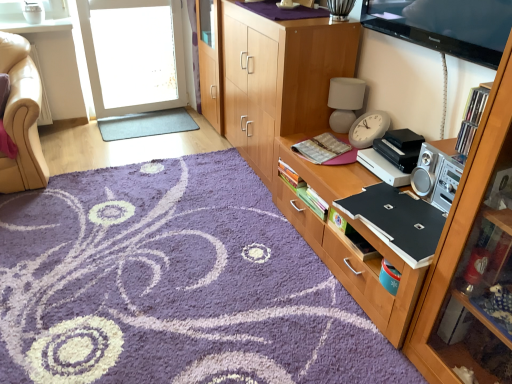
Question: From a real-world perspective, is clear plastic cds at upper right on purple shaggy rug at center, which is counted as the second plain, starting from the top?

Choices:
 (A) yes
 (B) no

Answer: (A)

Question: Does clear plastic cds at upper right turn towards purple shaggy rug at center, which is counted as the second plain, starting from the top?

Choices:
 (A) no
 (B) yes

Answer: (A)

Question: From the image's perspective, would you say clear plastic cds at upper right is positioned over purple shaggy rug at center, the 2th plain positioned from the back?

Choices:
 (A) yes
 (B) no

Answer: (A)

Question: Is clear plastic cds at upper right positioned before purple shaggy rug at center, which is counted as the second plain, starting from the top?

Choices:
 (A) no
 (B) yes

Answer: (A)

Question: Does clear plastic cds at upper right come behind purple shaggy rug at center, positioned as the 1th plain in bottom-to-top order?

Choices:
 (A) yes
 (B) no

Answer: (A)

Question: Considering their positions, is wooden cabinet at center, which ranks as the second cabinetry in front-to-back order, located in front of or behind clear plastic cds at upper right?

Choices:
 (A) front
 (B) behind

Answer: (B)

Question: From their relative heights in the image, would you say wooden cabinet at center, which is counted as the 2th cabinetry, starting from the back, is taller or shorter than clear plastic cds at upper right?

Choices:
 (A) tall
 (B) short

Answer: (A)

Question: Considering the positions of wooden cabinet at center, which ranks as the second cabinetry in front-to-back order, and clear plastic cds at upper right in the image, is wooden cabinet at center, which ranks as the second cabinetry in front-to-back order, bigger or smaller than clear plastic cds at upper right?

Choices:
 (A) big
 (B) small

Answer: (A)

Question: Based on their positions, is wooden cabinet at center, which ranks as the second cabinetry in front-to-back order, located to the left or right of clear plastic cds at upper right?

Choices:
 (A) right
 (B) left

Answer: (B)

Question: Is point (486, 96) closer or farther from the camera than point (348, 281)?

Choices:
 (A) closer
 (B) farther

Answer: (A)

Question: From the image's perspective, is clear plastic cds at upper right above or below wooden cabinet at center, which is counted as the 2th cabinetry, starting from the back?

Choices:
 (A) above
 (B) below

Answer: (A)

Question: Considering the positions of clear plastic cds at upper right and wooden cabinet at center, which ranks as the second cabinetry in front-to-back order, in the image, is clear plastic cds at upper right taller or shorter than wooden cabinet at center, which ranks as the second cabinetry in front-to-back order,?

Choices:
 (A) tall
 (B) short

Answer: (B)

Question: Is clear plastic cds at upper right to the left or to the right of wooden cabinet at center, which is counted as the 2th cabinetry, starting from the back, in the image?

Choices:
 (A) right
 (B) left

Answer: (A)

Question: Considering the positions of wooden cabinet at center, the third cabinetry from the front, and wooden cabinet at right, the third cabinetry positioned from the back, in the image, is wooden cabinet at center, the third cabinetry from the front, bigger or smaller than wooden cabinet at right, the third cabinetry positioned from the back,?

Choices:
 (A) small
 (B) big

Answer: (B)

Question: From the image's perspective, is wooden cabinet at center, arranged as the 1th cabinetry when viewed from the back, above or below wooden cabinet at right, the third cabinetry positioned from the back?

Choices:
 (A) above
 (B) below

Answer: (A)